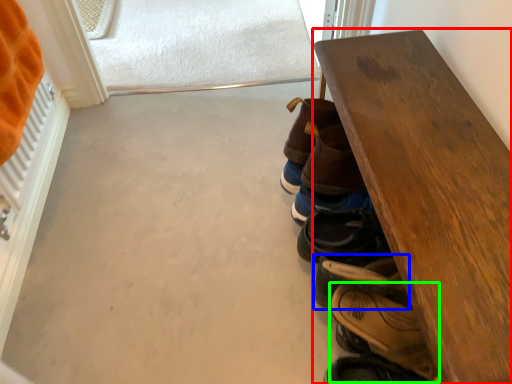
Question: Based on their relative distances, which object is nearer to table (highlighted by a red box)? Choose from footwear (highlighted by a blue box) and footwear (highlighted by a green box).

Choices:
 (A) footwear
 (B) footwear

Answer: (A)